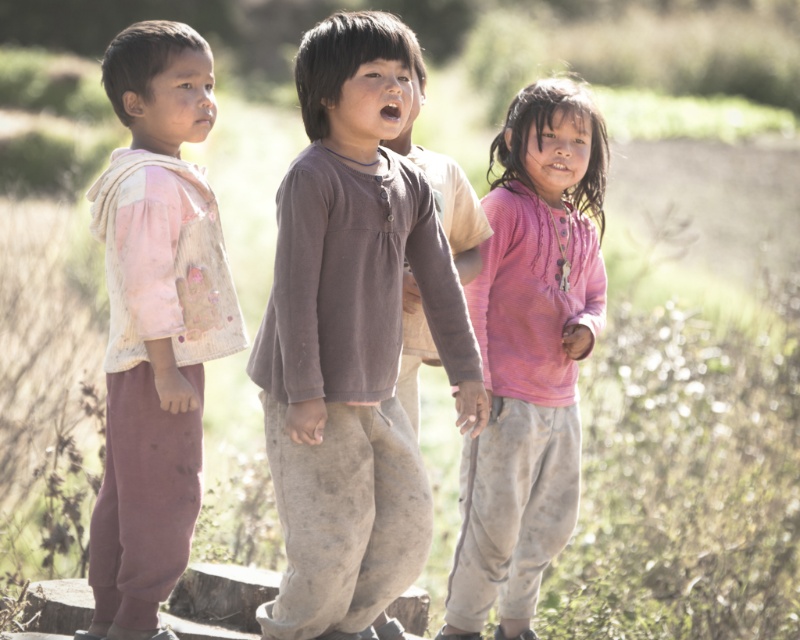
Is brown cotton shirt at center wider than pink fabric vest at left?

Yes, brown cotton shirt at center is wider than pink fabric vest at left.

Identify the location of brown cotton shirt at center. This screenshot has height=640, width=800. (352, 339).

Can you confirm if pink fabric vest at left is positioned to the left of pink ribbed sweater at center?

Indeed, pink fabric vest at left is positioned on the left side of pink ribbed sweater at center.

Does point (162, 355) lie behind point (566, 280)?

No, it is in front of (566, 280).

Does point (188, 392) come behind point (532, 192)?

No, it is not.

Where is `pink fabric vest at left`? pink fabric vest at left is located at coordinates (156, 323).

Is brown cotton shirt at center smaller than pink ribbed sweater at center?

Actually, brown cotton shirt at center might be larger than pink ribbed sweater at center.

Is brown cotton shirt at center above pink ribbed sweater at center?

Yes, brown cotton shirt at center is above pink ribbed sweater at center.

Which is behind, point (340, 237) or point (550, 512)?

The point (550, 512) is behind.

Locate an element on the screen. The image size is (800, 640). brown cotton shirt at center is located at coordinates (352, 339).